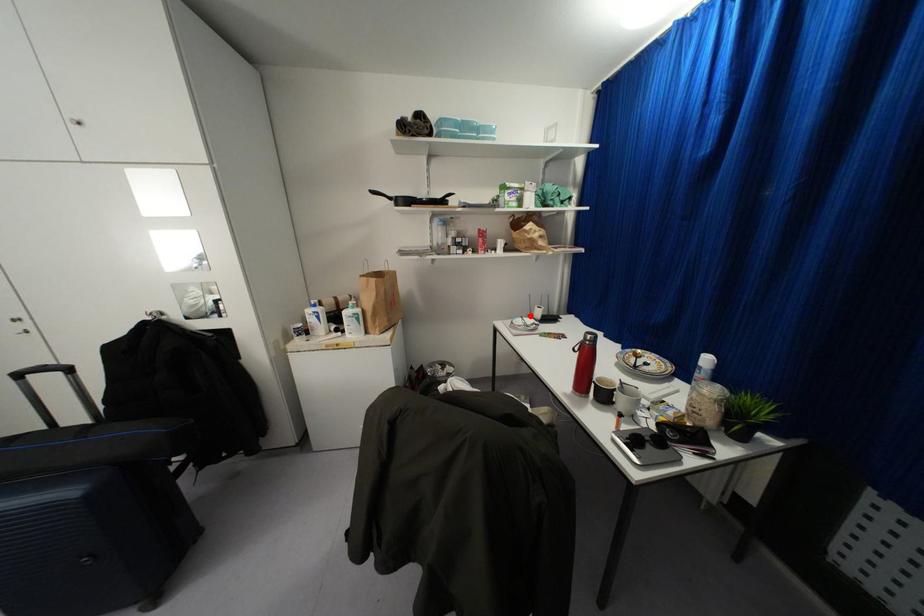
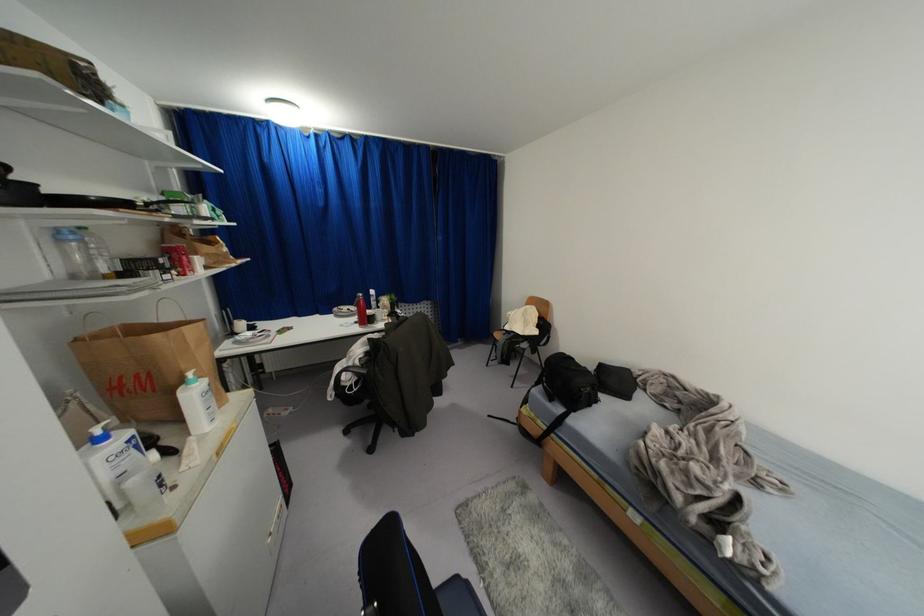
Question: I am providing you with two images of the same scene from different viewpoints. A red point is marked on the first image. At the location where the point appears in image 1, is it still visible in image 2?

Choices:
 (A) Yes
 (B) No

Answer: (A)